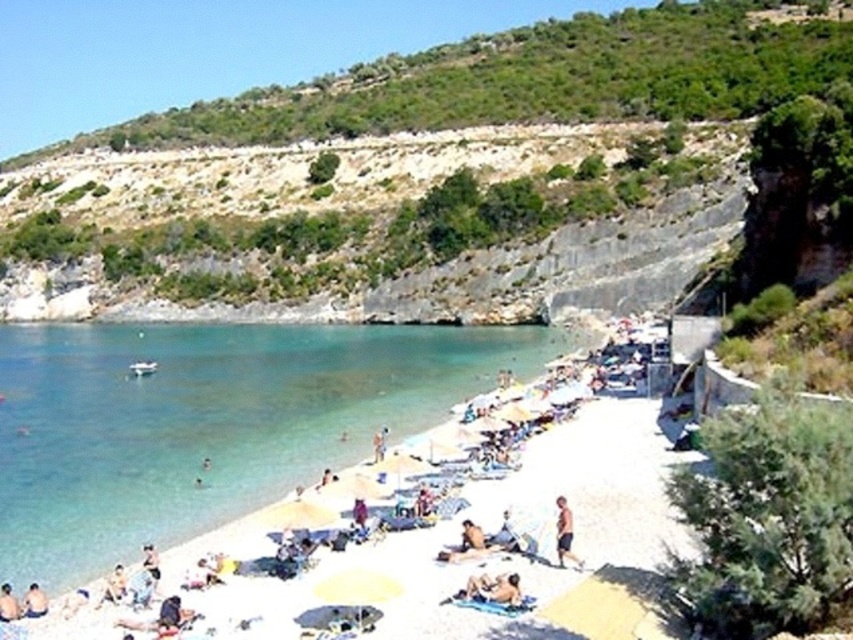
You are standing on the beach and see a tan skin person at lower center and a beige fabric towel at lower left. Which object is nearer to you?

The tan skin person at lower center is closer to the viewer than the beige fabric towel at lower left.

You are standing on the beach and see the beige fabric towel at lower left and the tan skin person at center. Which object is nearer to you?

The beige fabric towel at lower left is closer to the viewer than the tan skin person at center.

You are a beachgoer who wants to lay out your belongings. You have a beige fabric towel at lower left and a tan skin person at center. Where should you place your towel relative to the person to ensure it stays in the same spot?

Place the beige fabric towel at lower left to the left of the tan skin person at center to keep it in the same spot as shown in the scene.